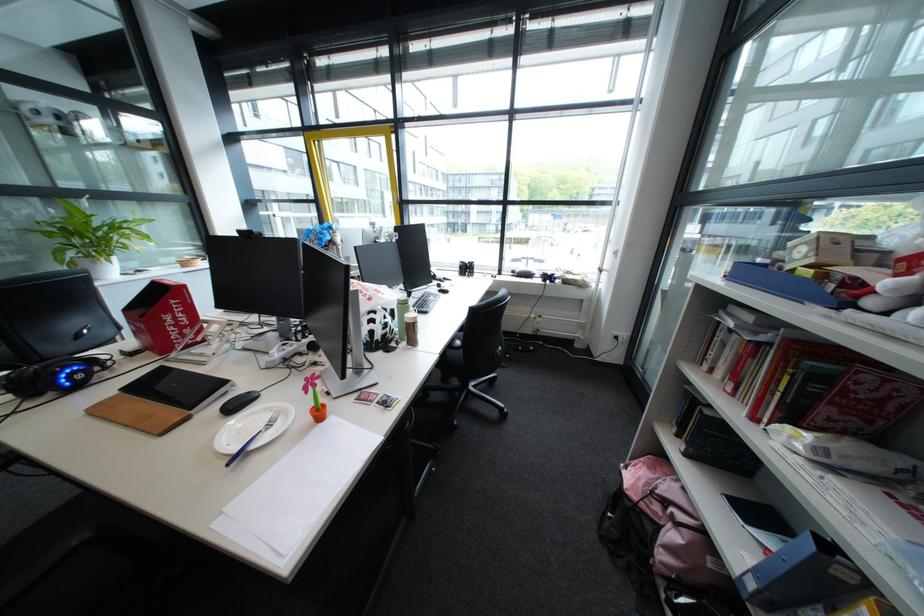
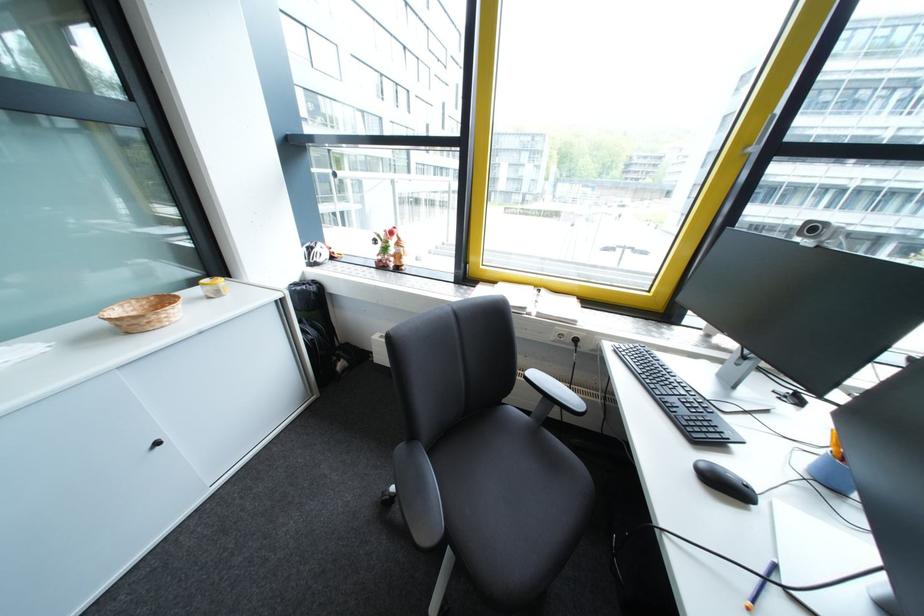
Which direction would the cameraman need to move to produce the second image?

The cameraman walked toward left, forward.